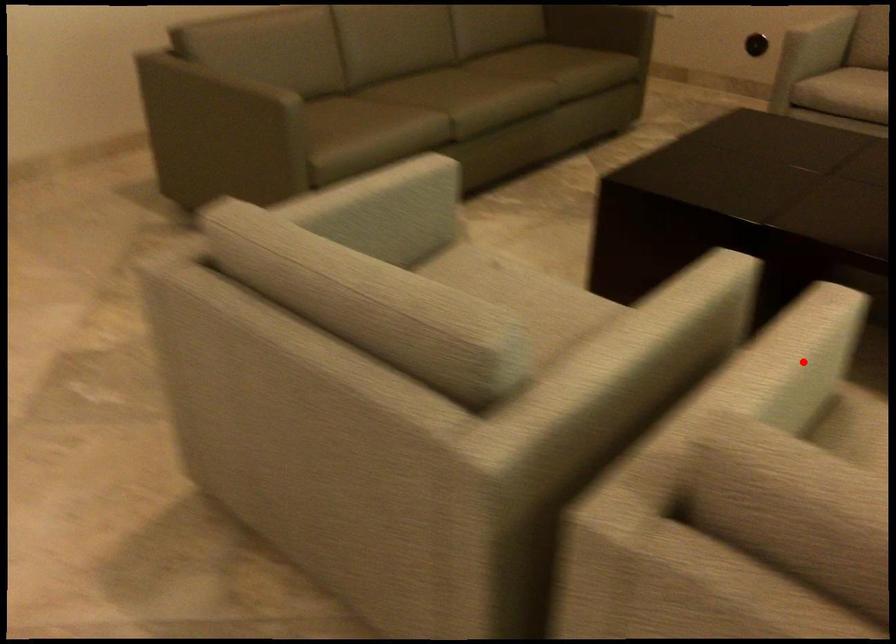
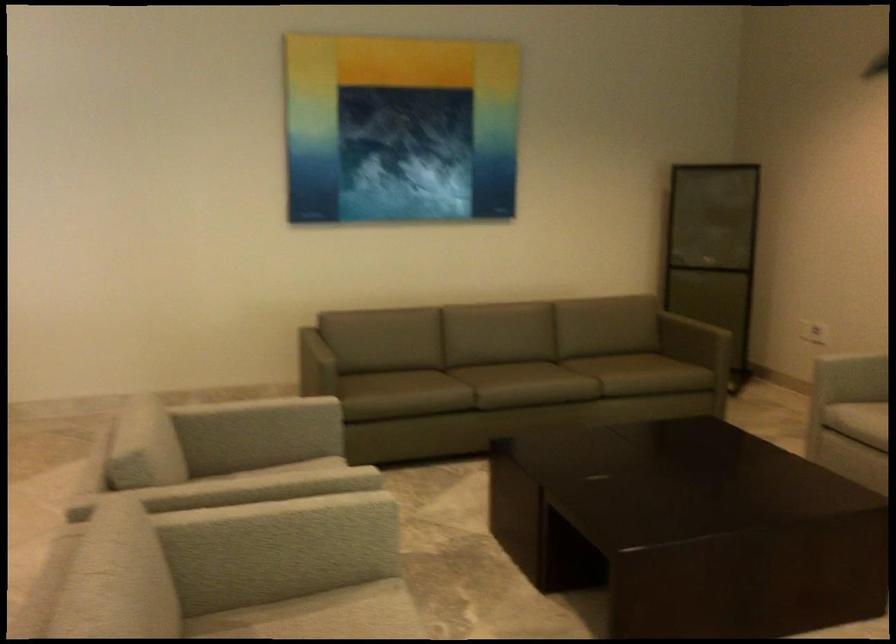
Question: I am providing you with two images of the same scene from different viewpoints. A red point is shown in image1. For the corresponding object point in image2, is it positioned nearer or farther from the camera?

Choices:
 (A) Nearer
 (B) Farther

Answer: (B)